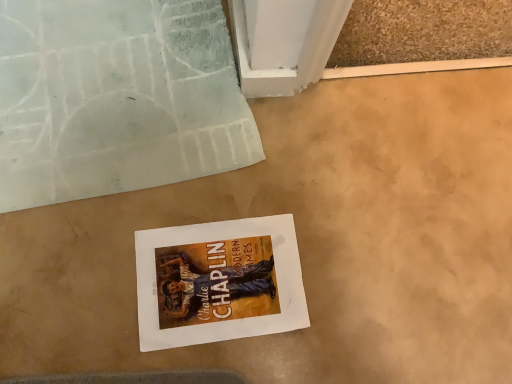
I want to click on white paper at lower center, so click(116, 98).

What do you see at coordinates (116, 98) in the screenshot? I see `white paper at lower center` at bounding box center [116, 98].

The image size is (512, 384). I want to click on white paper at lower center, so click(116, 98).